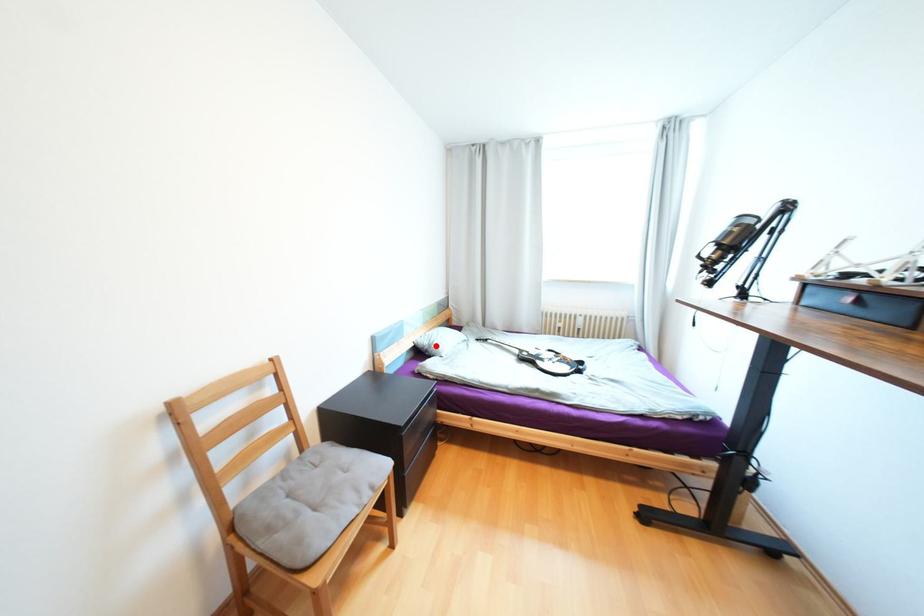
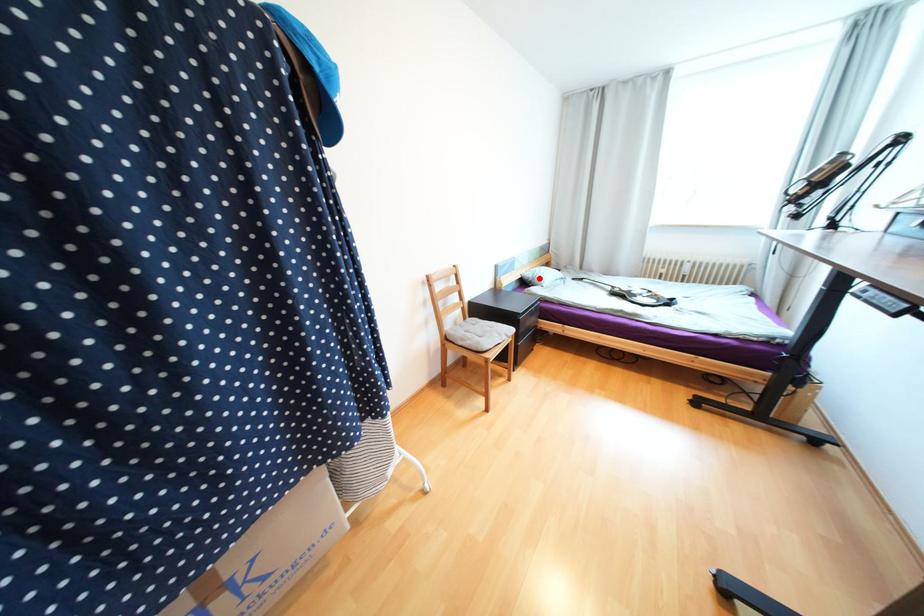
I am providing you with two images of the same scene from different viewpoints. A red point is marked on the first image and another point is marked on the second image. Do the highlighted points in image1 and image2 indicate the same real-world spot?

Yes